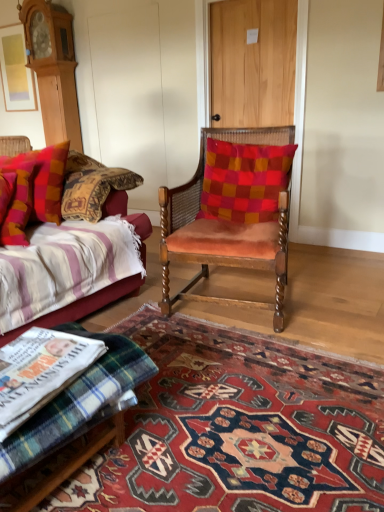
Question: Is point (125, 198) positioned closer to the camera than point (263, 430)?

Choices:
 (A) closer
 (B) farther

Answer: (B)

Question: In the image, is velvet striped couch at left positioned in front of or behind carpet with intricate patterns at center?

Choices:
 (A) behind
 (B) front

Answer: (A)

Question: Which is nearer to the plaid fabric pillow at left, positioned as the 1th pillow in left-to-right order?

Choices:
 (A) light brown wooden door at upper center
 (B) carpet with intricate patterns at center
 (C) plaid fabric footrest at lower left
 (D) velvet orange chair at center
 (E) velvet cushion at center, positioned as the 3th pillow in left-to-right order

Answer: (D)

Question: Which is farther from the velvet cushion at center, positioned as the 3th pillow in left-to-right order?

Choices:
 (A) light brown wooden door at upper center
 (B) plaid fabric pillow at left, the 3th pillow from the right
 (C) plaid fabric footrest at lower left
 (D) plush cotton pillow at left, the 2th pillow in the right-to-left sequence
 (E) velvet striped couch at left

Answer: (C)